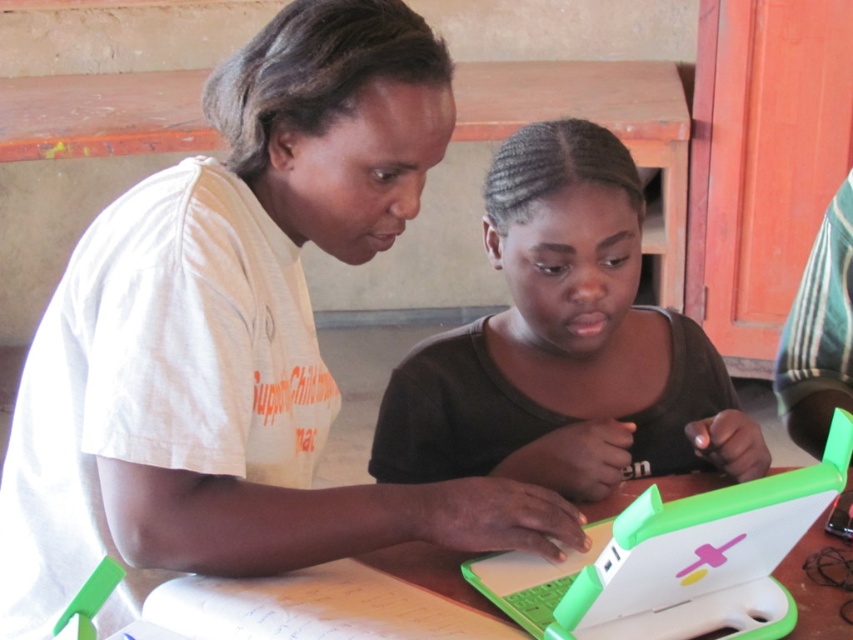
Question: Is matte green laptop at center positioned at the back of green plastic laptop at center?

Choices:
 (A) no
 (B) yes

Answer: (B)

Question: Can you confirm if white matte shirt at upper left is wider than green plastic laptop at center?

Choices:
 (A) yes
 (B) no

Answer: (A)

Question: Which of these objects is positioned farthest from the green plastic laptop at center?

Choices:
 (A) matte green laptop at center
 (B) white matte shirt at upper left

Answer: (B)

Question: Which point appears farthest from the camera in this image?

Choices:
 (A) pos(538,332)
 (B) pos(618,628)
 (C) pos(404,212)

Answer: (A)

Question: From the image, what is the correct spatial relationship of white matte shirt at upper left in relation to matte green laptop at center?

Choices:
 (A) below
 (B) above

Answer: (A)

Question: Considering the real-world distances, which object is closest to the matte green laptop at center?

Choices:
 (A) white matte shirt at upper left
 (B) green plastic laptop at center

Answer: (B)